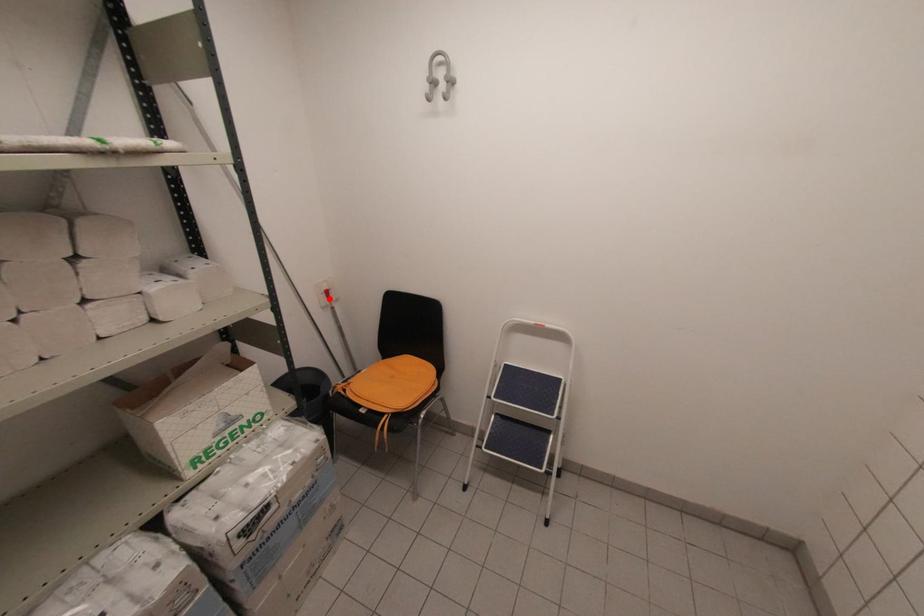
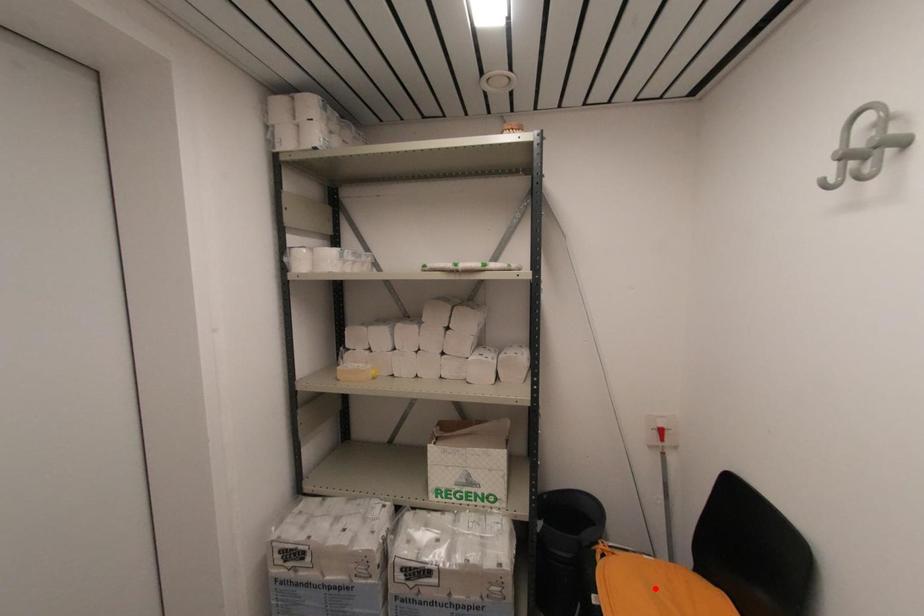
I am providing you with two images of the same scene from different viewpoints. A red point is marked on the first image and another point is marked on the second image. Does the point marked in image1 correspond to the same location as the one in image2?

No